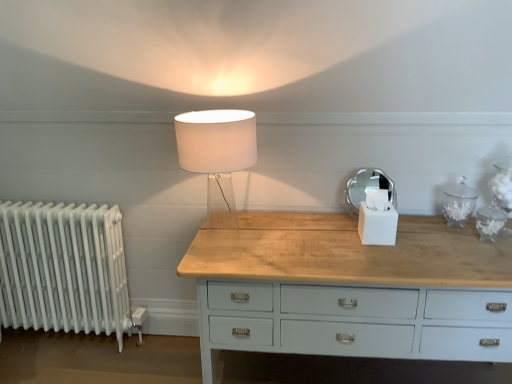
The width and height of the screenshot is (512, 384). I want to click on free space underneath white metallic radiator at left (from a real-world perspective), so click(x=67, y=337).